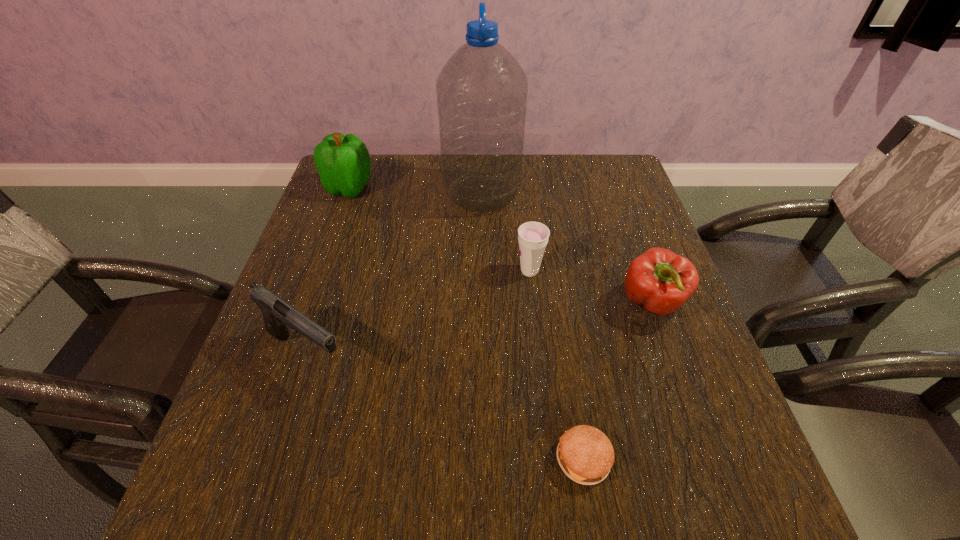
Identify the location of free space located 0.400m on the front of the farther bell pepper. The image size is (960, 540). (303, 318).

Identify the location of free space located 0.240m at the muzzle of the gun. (480, 354).

What are the coordinates of `vacant region located 0.310m on the back of the nearer bell pepper` in the screenshot? It's located at coord(614,198).

Find the location of a particular element. free spot located on the front of the cup is located at coordinates (538, 348).

Where is `free space located on the right of the hamburger`? This screenshot has width=960, height=540. free space located on the right of the hamburger is located at coordinates (753, 459).

The image size is (960, 540). What are the coordinates of `water jug located at the far edge` in the screenshot? It's located at (482, 91).

I want to click on bell pepper that is at the far edge, so click(x=343, y=162).

Identify the location of object positioned at the near edge. (585, 454).

This screenshot has width=960, height=540. Find the location of `bell pepper located in the left edge section of the desktop`. bell pepper located in the left edge section of the desktop is located at coordinates (343, 162).

Locate an element on the screen. The image size is (960, 540). gun that is at the left edge is located at coordinates (278, 316).